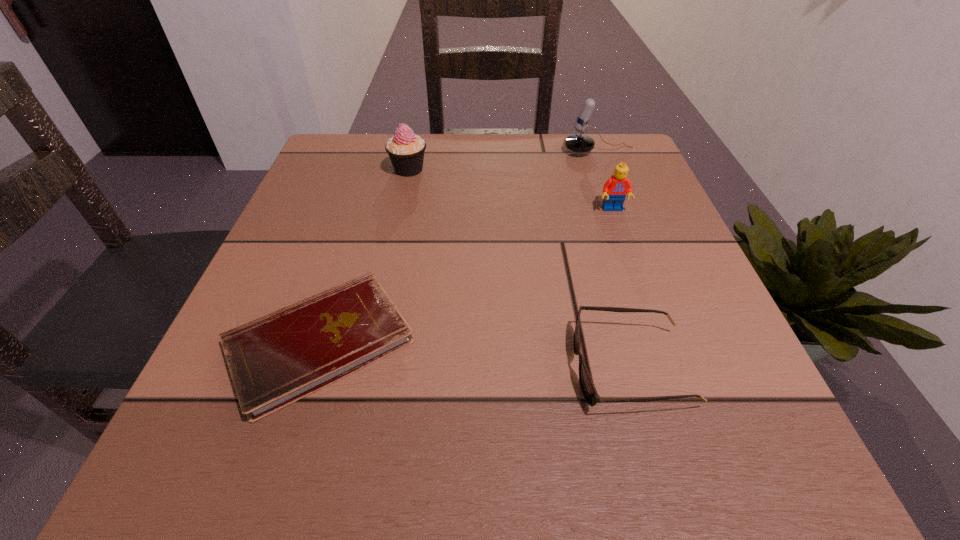
Locate an element on the screen. object positioned at the far right corner is located at coordinates (579, 143).

In the image, there is a desktop. Find the location of `free region at the far edge`. free region at the far edge is located at coordinates (453, 134).

Find the location of a particular element. free location at the near edge is located at coordinates [330, 437].

This screenshot has height=540, width=960. Find the location of `vacant space at the left edge of the desktop`. vacant space at the left edge of the desktop is located at coordinates (197, 404).

At what (x,y) coordinates should I click in order to perform the action: click on vacant space at the right edge of the desktop. Please return your answer as a coordinate pair (x, y). The image size is (960, 540). Looking at the image, I should click on (616, 222).

You are a GUI agent. You are given a task and a screenshot of the screen. Output one action in this format:
    pyautogui.click(x=<x>, y=<y>)
    Task: Click on the free spot at the far left corner of the desktop
    The width and height of the screenshot is (960, 540).
    Given the screenshot: What is the action you would take?
    [x=331, y=184]

Find the location of `free space at the near left corner of the desktop`. free space at the near left corner of the desktop is located at coordinates (230, 441).

I want to click on free region at the far right corner, so click(580, 156).

In order to click on free space that is in between the third farthest object and the fourth nearest object in this screenshot , I will do `click(511, 190)`.

This screenshot has width=960, height=540. I want to click on vacant point located between the cupcake and the shortest object, so click(364, 256).